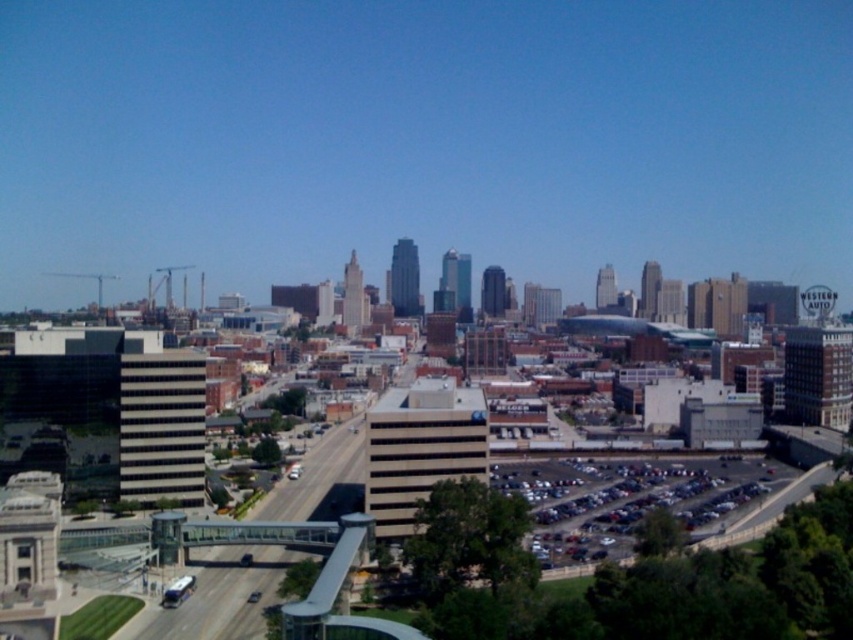
You are a delivery driver who needs to cross the smooth concrete highway at center. There is a pedestrian bridge connecting the glass and steel structure on the left to another building further down the street. How far apart are the two structures connected by the pedestrian bridge?

The two structures connected by the pedestrian bridge are 348.53 feet apart.

You are a city planner analyzing the image. Which area takes up more space in the image, the smooth concrete highway at center or the metallic gray cars at lower right?

The metallic gray cars at lower right occupy more space than the smooth concrete highway at center according to the description.

You are a delivery driver who needs to turn left onto the smooth concrete highway at center from the metallic gray cars at lower right. Is the highway positioned in a way that allows for a safe left turn from your current position?

Yes, the smooth concrete highway at center is to the left of the metallic gray cars at lower right, which means you can safely make a left turn from your current position onto the highway.